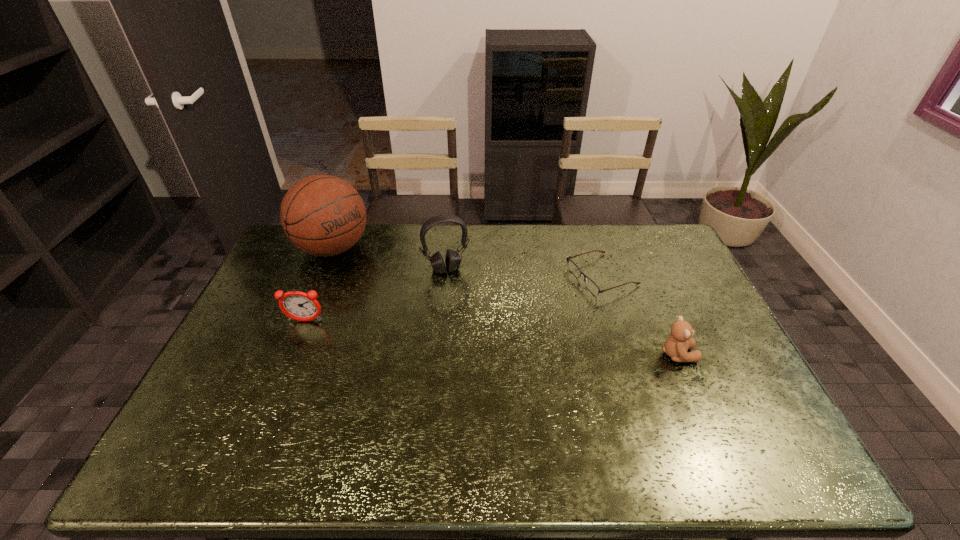
Find the location of a particular element. free space at the near right corner of the desktop is located at coordinates (707, 399).

Find the location of `free spot between the fourth farthest object and the teddy bear`. free spot between the fourth farthest object and the teddy bear is located at coordinates (492, 338).

The image size is (960, 540). I want to click on free spot between the headset and the alarm clock, so click(375, 295).

The height and width of the screenshot is (540, 960). What are the coordinates of `unoccupied area between the second nearest object and the third object from right to left` in the screenshot? It's located at (375, 295).

This screenshot has width=960, height=540. In order to click on vacant space that's between the spectacles and the headset in this screenshot , I will do `click(524, 272)`.

At what (x,y) coordinates should I click in order to perform the action: click on empty location between the teddy bear and the basketball. Please return your answer as a coordinate pair (x, y). This screenshot has width=960, height=540. Looking at the image, I should click on (505, 301).

Locate an element on the screen. The height and width of the screenshot is (540, 960). vacant space that's between the tallest object and the shortest object is located at coordinates (468, 262).

What are the coordinates of `free space between the spectacles and the tallest object` in the screenshot? It's located at (468, 262).

The width and height of the screenshot is (960, 540). Find the location of `free space between the third object from left to right and the tallest object`. free space between the third object from left to right and the tallest object is located at coordinates (390, 259).

This screenshot has height=540, width=960. What are the coordinates of `blank region between the third object from right to left and the tallest object` in the screenshot? It's located at (390, 259).